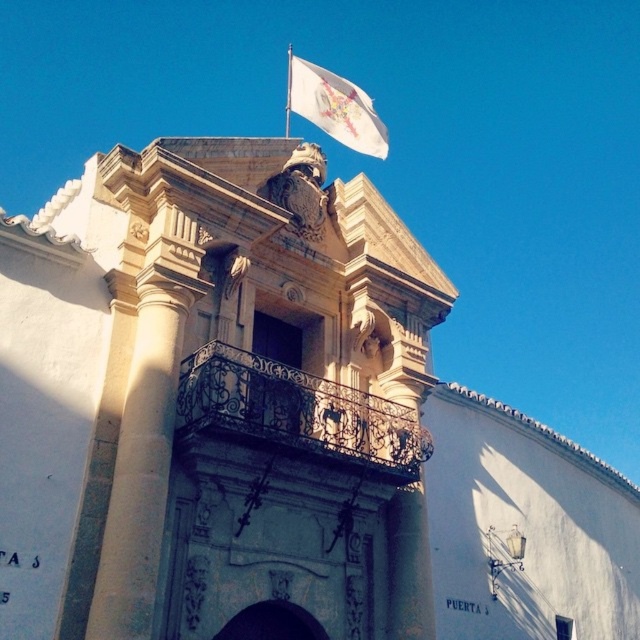
You are an architect inspecting the historic building. You need to determine the spatial relationship between the wrought iron balcony at center and the white fabric flag at upper center. Based on the scene, which object is positioned higher?

The white fabric flag at upper center is positioned higher than the wrought iron balcony at center, as it is located above it.

You are standing in front of the historic building and want to locate the wrought iron balcony at center. According to the coordinates provided, where exactly should you look?

The wrought iron balcony at center is located at point (298,413).

You are an architect examining the historic building. You need to determine which object, the smooth stone column at center or the wrought iron balcony at center, has a larger size. Based on the scene, which one is bigger?

The wrought iron balcony at center is larger than the smooth stone column at center.